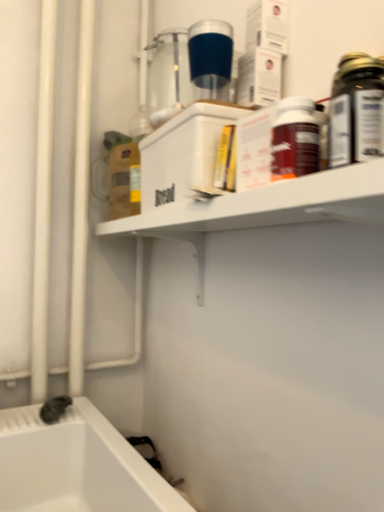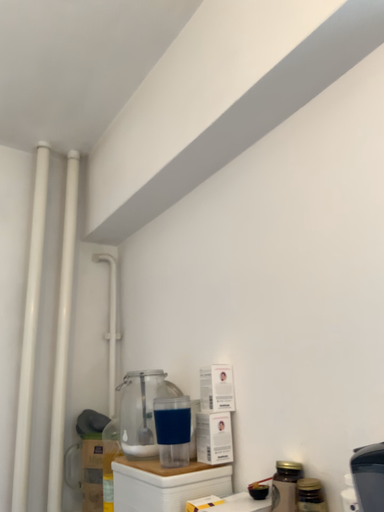
Question: How did the camera likely rotate when shooting the video?

Choices:
 (A) rotated upward
 (B) rotated downward

Answer: (A)